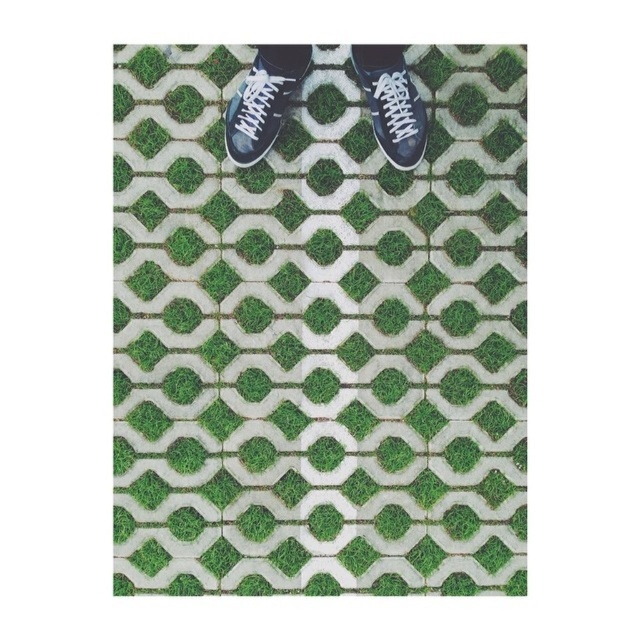
Who is higher up, green grass at center or matte black sneaker at upper right?

matte black sneaker at upper right is higher up.

Is point (465, 246) closer to camera compared to point (380, 140)?

No.

Find the location of a particular element. Image resolution: width=640 pixels, height=640 pixels. green grass at center is located at coordinates (317, 332).

Does green grass at center appear on the left side of black leather shoe at center?

Incorrect, green grass at center is not on the left side of black leather shoe at center.

Is green grass at center in front of black leather shoe at center?

No.

Identify the location of green grass at center. (317, 332).

Locate an element on the screen. green grass at center is located at coordinates (317, 332).

Which of these two, black leather shoe at center or matte black sneaker at upper right, stands shorter?

With less height is matte black sneaker at upper right.

Which is above, black leather shoe at center or matte black sneaker at upper right?

black leather shoe at center is above.

Locate an element on the screen. This screenshot has height=640, width=640. black leather shoe at center is located at coordinates (262, 100).